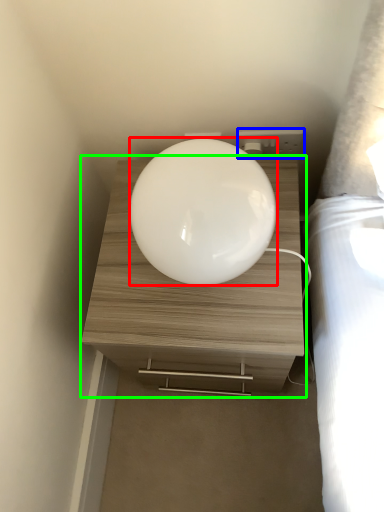
Question: Based on their relative distances, which object is nearer to oval (highlighted by a red box)? Choose from electric outlet (highlighted by a blue box) and nightstand (highlighted by a green box).

Choices:
 (A) electric outlet
 (B) nightstand

Answer: (B)